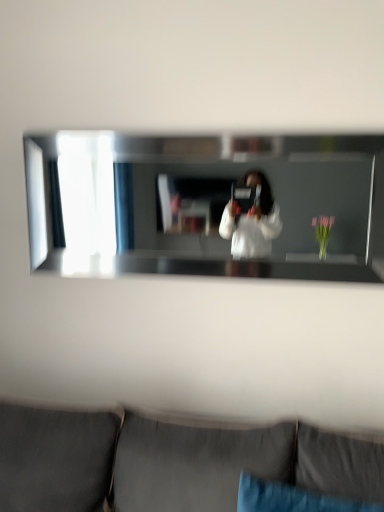
Question: Should I look upward or downward to see blue fabric pillow at lower center?

Choices:
 (A) down
 (B) up

Answer: (A)

Question: Can you confirm if clear glass mirror at center is taller than blue fabric pillow at lower center?

Choices:
 (A) no
 (B) yes

Answer: (B)

Question: Is clear glass mirror at center at the left side of blue fabric pillow at lower center?

Choices:
 (A) no
 (B) yes

Answer: (B)

Question: Does clear glass mirror at center lie behind blue fabric pillow at lower center?

Choices:
 (A) no
 (B) yes

Answer: (B)

Question: Can blue fabric pillow at lower center be found inside clear glass mirror at center?

Choices:
 (A) yes
 (B) no

Answer: (B)

Question: Can you confirm if clear glass mirror at center is bigger than blue fabric pillow at lower center?

Choices:
 (A) yes
 (B) no

Answer: (A)

Question: Does clear glass mirror at center touch blue fabric pillow at lower center?

Choices:
 (A) no
 (B) yes

Answer: (A)

Question: From the image's perspective, is blue fabric pillow at lower center over clear glass mirror at center?

Choices:
 (A) yes
 (B) no

Answer: (B)

Question: Would you say blue fabric pillow at lower center is a long distance from clear glass mirror at center?

Choices:
 (A) yes
 (B) no

Answer: (A)

Question: Is blue fabric pillow at lower center surrounding clear glass mirror at center?

Choices:
 (A) yes
 (B) no

Answer: (B)

Question: From a real-world perspective, is blue fabric pillow at lower center over clear glass mirror at center?

Choices:
 (A) no
 (B) yes

Answer: (A)

Question: Can you confirm if blue fabric pillow at lower center is positioned to the left of clear glass mirror at center?

Choices:
 (A) yes
 (B) no

Answer: (B)

Question: Are blue fabric pillow at lower center and clear glass mirror at center making contact?

Choices:
 (A) yes
 (B) no

Answer: (B)

Question: Would you say dark gray fabric couch at lower center is outside blue fabric pillow at lower center?

Choices:
 (A) no
 (B) yes

Answer: (B)